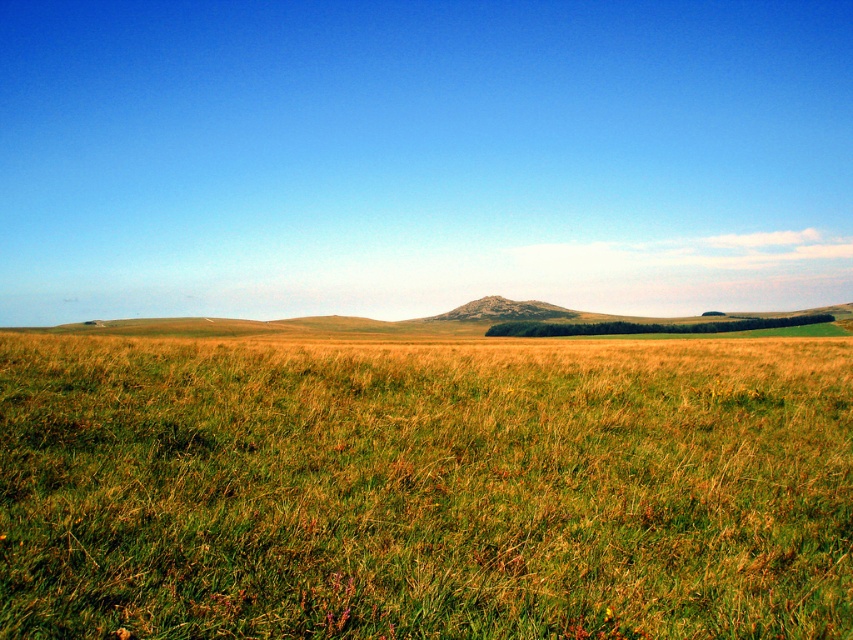
Question: Which of the following is the farthest from the observer?

Choices:
 (A) rustic granite mountain at center
 (B) green grassy field at center

Answer: (A)

Question: Is green grassy field at center smaller than rustic granite mountain at center?

Choices:
 (A) yes
 (B) no

Answer: (A)

Question: Which point is closer to the camera taking this photo?

Choices:
 (A) (509, 308)
 (B) (381, 413)

Answer: (B)

Question: Does green grassy field at center lie in front of rustic granite mountain at center?

Choices:
 (A) yes
 (B) no

Answer: (A)

Question: Is green grassy field at center in front of rustic granite mountain at center?

Choices:
 (A) no
 (B) yes

Answer: (B)